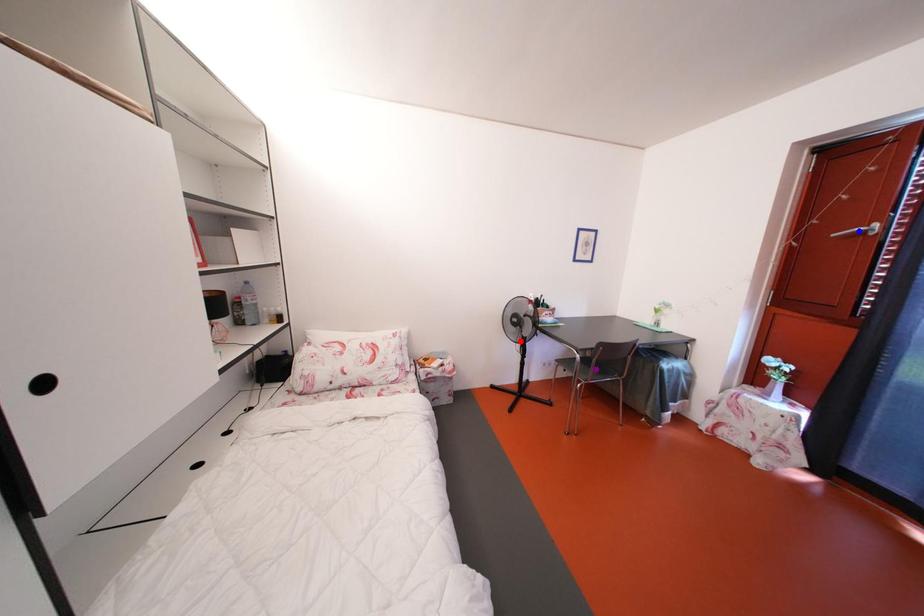
Order these from nearest to farthest:
blue point, red point, purple point

red point, purple point, blue point